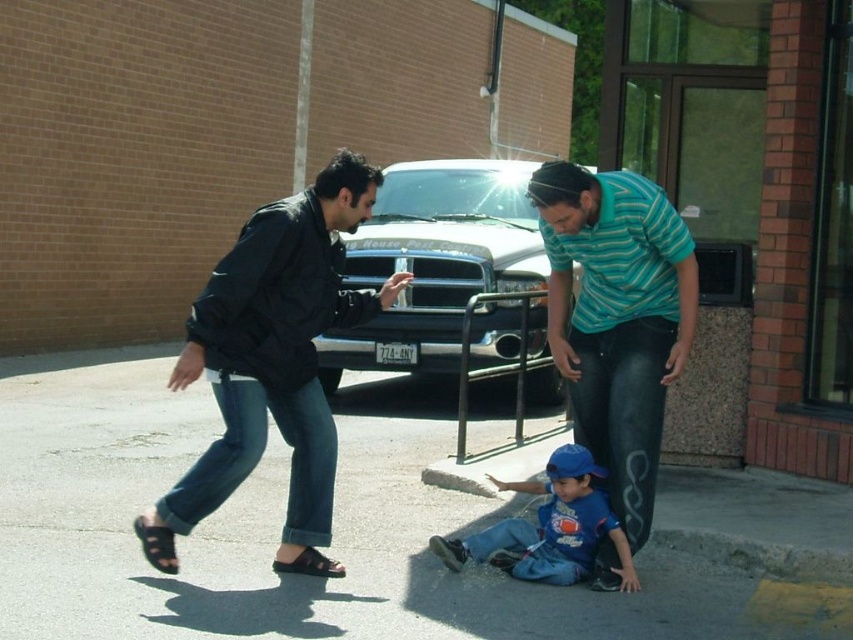
Can you confirm if concrete curb at lower center is smaller than blue cotton shirt at lower center?

Incorrect, concrete curb at lower center is not smaller in size than blue cotton shirt at lower center.

Is concrete curb at lower center shorter than blue cotton shirt at lower center?

Indeed, concrete curb at lower center has a lesser height compared to blue cotton shirt at lower center.

What do you see at coordinates (756, 522) in the screenshot? I see `concrete curb at lower center` at bounding box center [756, 522].

At what (x,y) coordinates should I click in order to perform the action: click on concrete curb at lower center. Please return your answer as a coordinate pair (x, y). Looking at the image, I should click on (756, 522).

Can you confirm if gray asphalt at center is bigger than blue cotton shirt at lower center?

Actually, gray asphalt at center might be smaller than blue cotton shirt at lower center.

This screenshot has width=853, height=640. I want to click on gray asphalt at center, so click(363, 529).

Can you confirm if blue cotton shirt at lower center is positioned to the left of black rubber sandal at lower left?

Incorrect, blue cotton shirt at lower center is not on the left side of black rubber sandal at lower left.

Is point (601, 538) positioned in front of point (305, 563)?

Yes, it is in front of point (305, 563).

Locate an element on the screen. The height and width of the screenshot is (640, 853). blue cotton shirt at lower center is located at coordinates (550, 529).